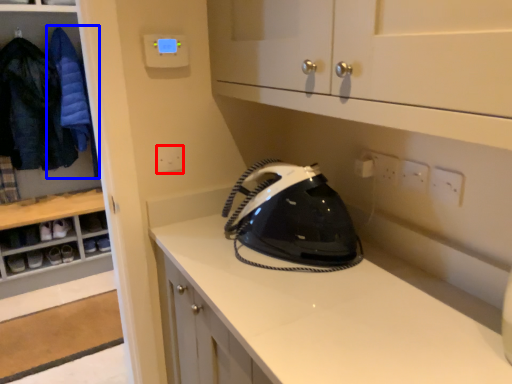
Question: Which of the following is the closest to the observer, electric outlet (highlighted by a red box) or clothing (highlighted by a blue box)?

Choices:
 (A) electric outlet
 (B) clothing

Answer: (A)